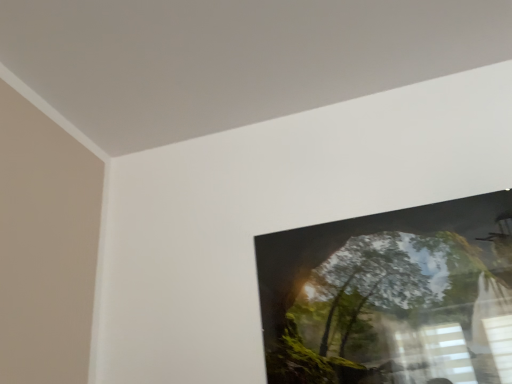
Find the location of a particular element. This screenshot has height=384, width=512. metallic glossy picture frame at upper right is located at coordinates point(391,296).

What do you see at coordinates (391, 296) in the screenshot? I see `metallic glossy picture frame at upper right` at bounding box center [391, 296].

Identify the location of metallic glossy picture frame at upper right. (391, 296).